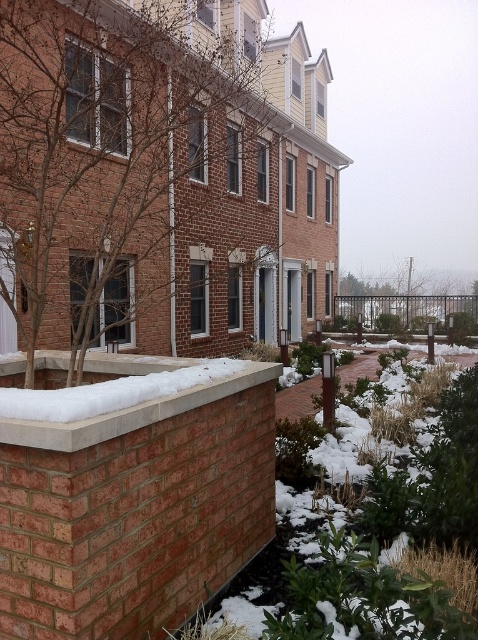
You are standing in front of the row of brick townhouses and want to take a photo of the concrete at center and the green leafy tree at center. Which object should you focus on first to ensure both are in sharp focus?

You should focus on the concrete at center first because it is closer to the viewer than the green leafy tree at center, so adjusting focus from near to far will help both be in sharp focus.

You are a gardener assessing the winter landscape. You observe the brown leafless tree at upper left and the green leafy tree at center. Which tree would require more pruning in spring to maintain their sizes relative to each other?

The green leafy tree at center would require more pruning in spring because it is larger than the brown leafless tree at upper left, as stated in the description.

You are standing in front of the row of townhouses and see the brown leafless tree at upper left and the green leafy tree at center. Which tree is closer to the left side of the row of townhouses?

The brown leafless tree at upper left is closer to the left side of the row of townhouses because it is positioned on the left side of the green leafy tree at center.